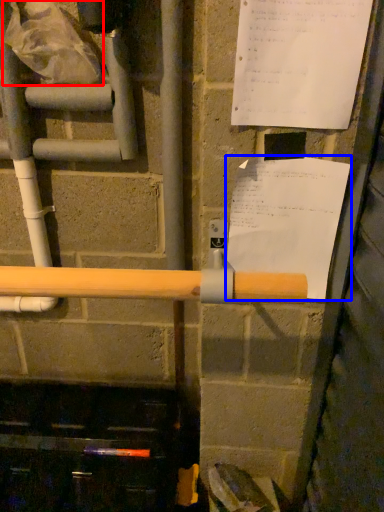
Question: Which object is closer to the camera taking this photo, plastic bag (highlighted by a red box) or paper (highlighted by a blue box)?

Choices:
 (A) plastic bag
 (B) paper

Answer: (B)